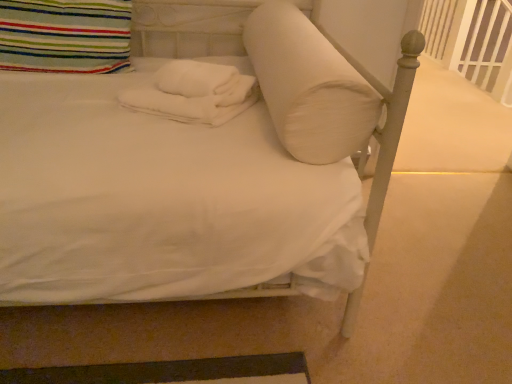
Question: Is white plastic balustrade at upper right oriented towards white soft towels at center?

Choices:
 (A) yes
 (B) no

Answer: (B)

Question: Is white plastic balustrade at upper right in front of white soft towels at center?

Choices:
 (A) no
 (B) yes

Answer: (A)

Question: From a real-world perspective, is white plastic balustrade at upper right under white soft towels at center?

Choices:
 (A) no
 (B) yes

Answer: (B)

Question: Considering the relative positions of white plastic balustrade at upper right and white soft towels at center in the image provided, is white plastic balustrade at upper right behind white soft towels at center?

Choices:
 (A) no
 (B) yes

Answer: (B)

Question: Considering the relative sizes of white plastic balustrade at upper right and white soft towels at center in the image provided, is white plastic balustrade at upper right taller than white soft towels at center?

Choices:
 (A) no
 (B) yes

Answer: (B)

Question: From the image's perspective, relative to white plastic balustrade at upper right, is white soft pillow at center, the second pillow when ordered from left to right, above or below?

Choices:
 (A) below
 (B) above

Answer: (A)

Question: Would you say white soft pillow at center, the second pillow when ordered from left to right, is to the left or to the right of white plastic balustrade at upper right in the picture?

Choices:
 (A) right
 (B) left

Answer: (B)

Question: From a real-world perspective, relative to white plastic balustrade at upper right, is white soft pillow at center, the second pillow when ordered from left to right, vertically above or below?

Choices:
 (A) below
 (B) above

Answer: (B)

Question: Is white soft pillow at center, the second pillow when ordered from left to right, inside the boundaries of white plastic balustrade at upper right, or outside?

Choices:
 (A) outside
 (B) inside

Answer: (A)

Question: Does point (314, 158) appear closer or farther from the camera than point (53, 66)?

Choices:
 (A) closer
 (B) farther

Answer: (A)

Question: Visually, is white soft pillow at center, which is counted as the first pillow, starting from the right, positioned to the left or to the right of striped fabric pillow at upper left, the 2th pillow positioned from the right?

Choices:
 (A) right
 (B) left

Answer: (A)

Question: In terms of width, does white soft pillow at center, which is counted as the first pillow, starting from the right, look wider or thinner when compared to striped fabric pillow at upper left, the 2th pillow positioned from the right?

Choices:
 (A) wide
 (B) thin

Answer: (A)

Question: From the image's perspective, relative to striped fabric pillow at upper left, the first pillow in the left-to-right sequence, is white soft pillow at center, which is counted as the first pillow, starting from the right, above or below?

Choices:
 (A) above
 (B) below

Answer: (B)

Question: In terms of size, does white plastic balustrade at upper right appear bigger or smaller than white soft pillow at center, which is counted as the first pillow, starting from the right?

Choices:
 (A) big
 (B) small

Answer: (A)

Question: Is white plastic balustrade at upper right in front of or behind white soft pillow at center, the second pillow when ordered from left to right, in the image?

Choices:
 (A) behind
 (B) front

Answer: (A)